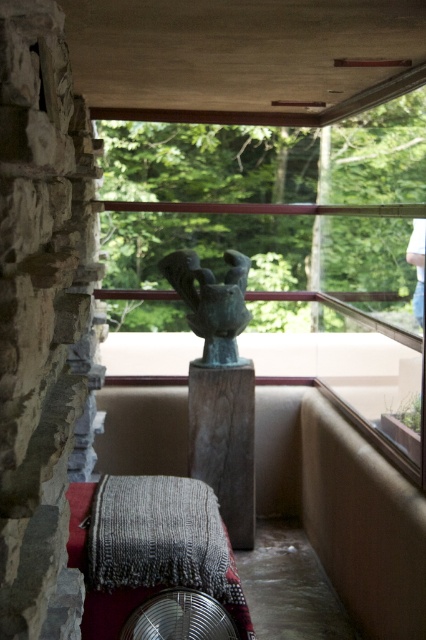
Who is more forward, (229,429) or (189,305)?

Positioned in front is point (229,429).

Does wooden pole at center have a smaller size compared to bronze statue at center?

Correct, wooden pole at center occupies less space than bronze statue at center.

In order to click on wooden pole at center in this screenshot , I will do `click(224, 442)`.

Is the position of bronze statue at center more distant than that of metallic silver fan at lower center?

Yes, bronze statue at center is behind metallic silver fan at lower center.

Who is higher up, bronze statue at center or metallic silver fan at lower center?

bronze statue at center is above.

Does point (176, 262) come behind point (149, 628)?

Yes.

Locate an element on the screen. Image resolution: width=426 pixels, height=640 pixels. bronze statue at center is located at coordinates (212, 301).

Describe the element at coordinates (279, 257) in the screenshot. I see `green patina metal sculpture at center` at that location.

Which is more to the left, green patina metal sculpture at center or wooden pole at center?

From the viewer's perspective, wooden pole at center appears more on the left side.

Image resolution: width=426 pixels, height=640 pixels. What are the coordinates of `green patina metal sculpture at center` in the screenshot? It's located at (279, 257).

Find the location of `green patina metal sculpture at center`. green patina metal sculpture at center is located at coordinates (279, 257).